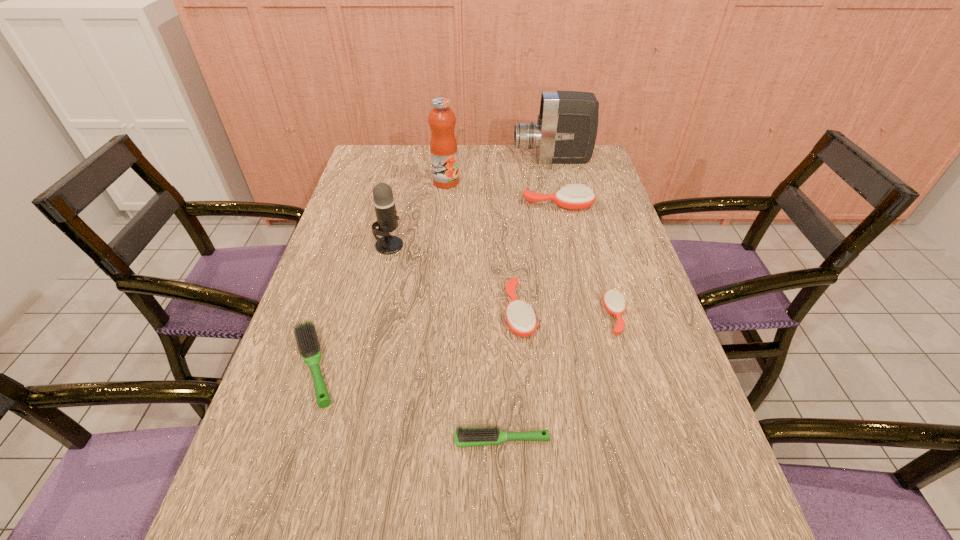
In order to click on blank space that satisfies the following two spatial constraints: 1. on the front side of the smallest orange hairbrush; 2. on the right side of the fifth nearest object in this screenshot , I will do `click(372, 316)`.